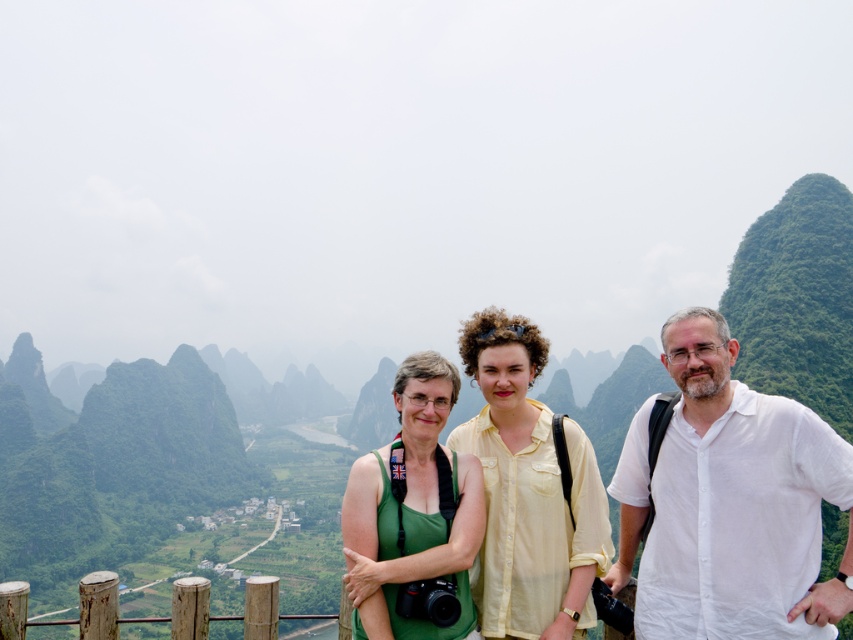
Is point (517, 464) less distant than point (22, 612)?

No, it is not.

Between point (587, 561) and point (262, 605), which one is positioned in front?

Point (262, 605)

Between point (537, 596) and point (83, 582), which one is positioned behind?

Positioned behind is point (537, 596).

Locate an element on the screen. The image size is (853, 640). yellow matte shirt at center is located at coordinates (527, 492).

Based on the photo, is yellow matte shirt at center to the left of green fabric tank top at center from the viewer's perspective?

Incorrect, yellow matte shirt at center is not on the left side of green fabric tank top at center.

Is yellow matte shirt at center above green fabric tank top at center?

Indeed, yellow matte shirt at center is positioned over green fabric tank top at center.

Is point (535, 355) less distant than point (431, 538)?

No.

Find the location of a particular element. This screenshot has width=853, height=640. yellow matte shirt at center is located at coordinates (527, 492).

Between white cotton shirt at right and brown wood fence at lower left, which one appears on the right side from the viewer's perspective?

Positioned to the right is white cotton shirt at right.

Does white cotton shirt at right have a greater height compared to brown wood fence at lower left?

In fact, white cotton shirt at right may be shorter than brown wood fence at lower left.

Between point (778, 506) and point (90, 612), which one is positioned in front?

Point (90, 612)

Where is `white cotton shirt at right`? This screenshot has width=853, height=640. white cotton shirt at right is located at coordinates (738, 502).